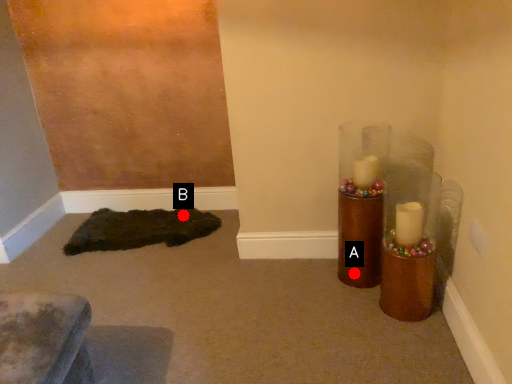
Question: Two points are circled on the image, labeled by A and B beside each circle. Among these points, which one is farthest from the camera?

Choices:
 (A) A is further
 (B) B is further

Answer: (B)